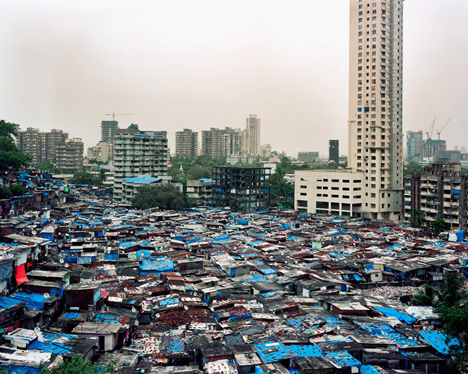
Locate an element on the screen. window is located at coordinates (413, 145).